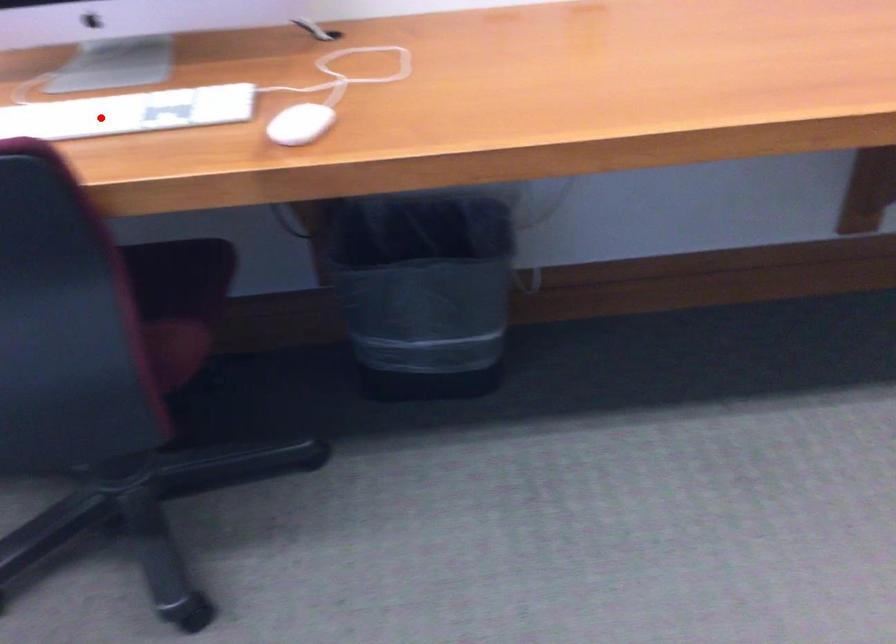
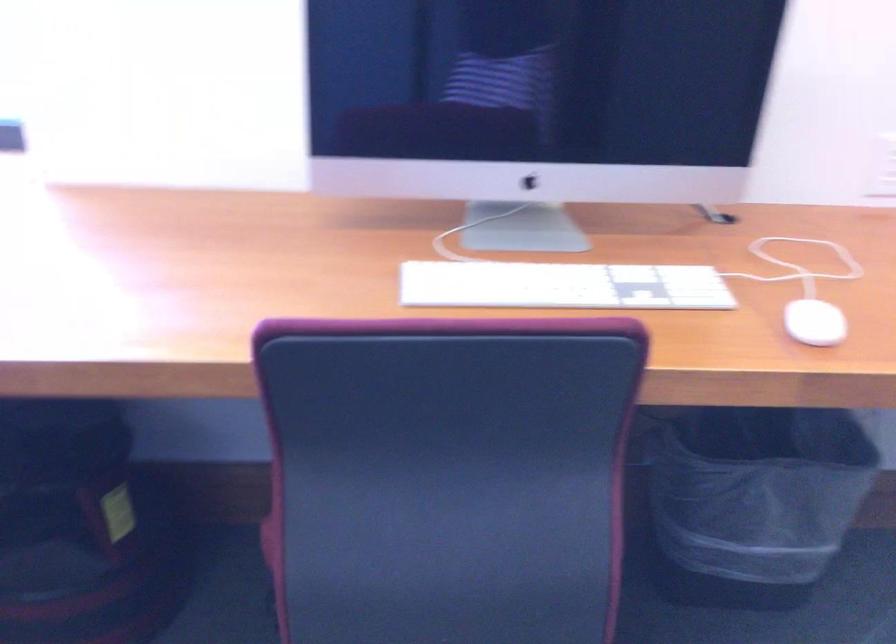
The point at the highlighted location is marked in the first image. Where is the corresponding point in the second image?

(562, 285)